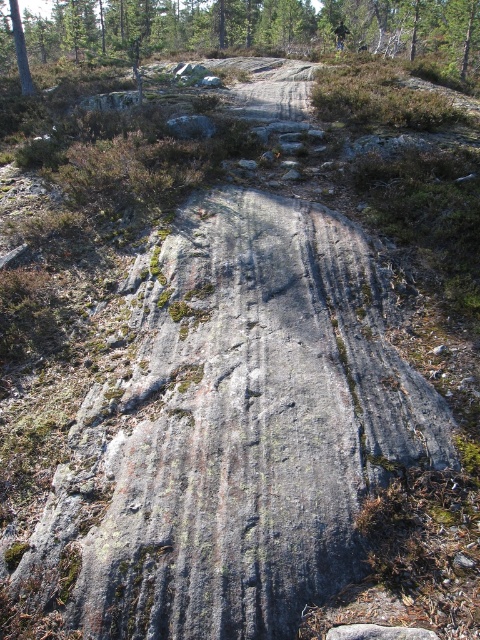
Looking at this image, who is shorter, smooth bark tree at upper left or dark green fabric mountain biker at upper center?

smooth bark tree at upper left is shorter.

Who is taller, smooth bark tree at upper left or dark green fabric mountain biker at upper center?

dark green fabric mountain biker at upper center is taller.

Is point (31, 84) farther from camera compared to point (345, 36)?

That is False.

Where is `smooth bark tree at upper left`? The width and height of the screenshot is (480, 640). smooth bark tree at upper left is located at coordinates (21, 49).

Is green mossy rock at upper center to the right of smooth bark tree at upper left from the viewer's perspective?

Correct, you'll find green mossy rock at upper center to the right of smooth bark tree at upper left.

Who is more forward, (x=444, y=48) or (x=24, y=67)?

Positioned in front is point (x=24, y=67).

Find the location of a particular element. This screenshot has width=480, height=640. green mossy rock at upper center is located at coordinates (274, 28).

I want to click on green mossy rock at upper center, so click(274, 28).

Is point (468, 38) positioned before point (344, 35)?

Yes, point (468, 38) is closer to viewer.

Does green mossy rock at upper center appear over dark green fabric mountain biker at upper center?

Yes.

Is point (104, 29) closer to viewer compared to point (335, 33)?

No, it is not.

Where is `green mossy rock at upper center`? green mossy rock at upper center is located at coordinates (274, 28).